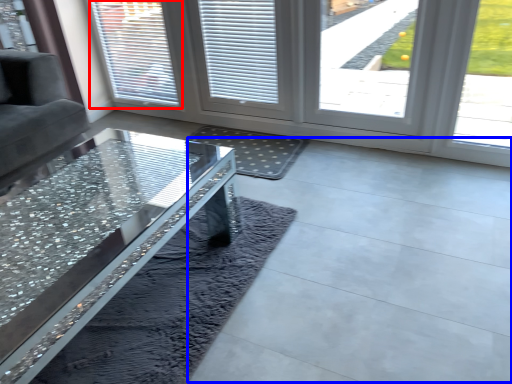
Question: Which of the following is the closest to the observer, window (highlighted by a red box) or concrete (highlighted by a blue box)?

Choices:
 (A) window
 (B) concrete

Answer: (B)